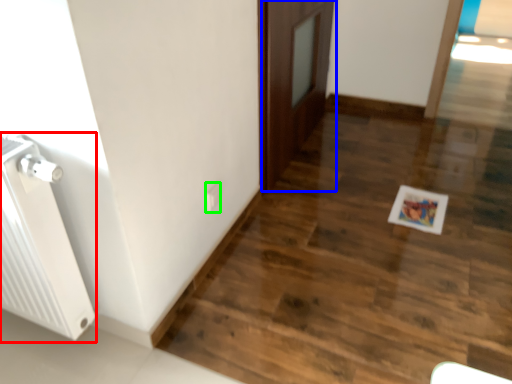
Question: Which is nearer to the radiator (highlighted by a red box)? door (highlighted by a blue box) or electric outlet (highlighted by a green box).

Choices:
 (A) door
 (B) electric outlet

Answer: (B)